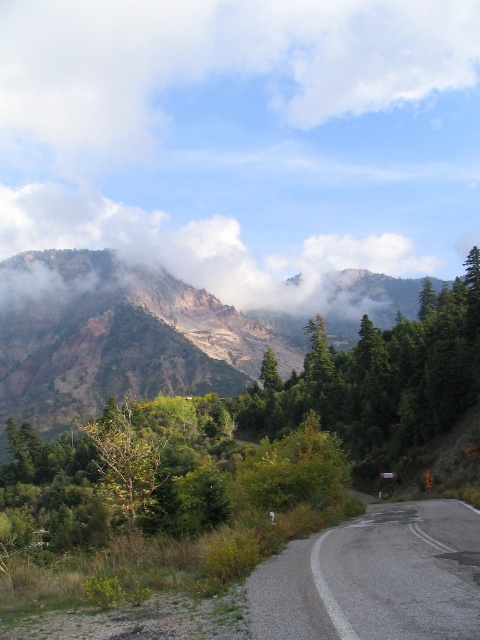
Does foggy misty mountain at upper center appear under green leafy tree at center?

No.

Describe the element at coordinates (216, 253) in the screenshot. I see `foggy misty mountain at upper center` at that location.

Find the location of a particular element. The height and width of the screenshot is (640, 480). foggy misty mountain at upper center is located at coordinates (216, 253).

Is rustic stone mountain at upper left positioned behind green leafy tree at center?

Yes, it is behind green leafy tree at center.

Is rustic stone mountain at upper left smaller than green leafy tree at center?

No.

The width and height of the screenshot is (480, 640). In order to click on rustic stone mountain at upper left in this screenshot , I will do `click(120, 337)`.

Between gray asphalt road at lower right and green leafy tree at center, which one is positioned higher?

gray asphalt road at lower right is above.

Image resolution: width=480 pixels, height=640 pixels. Describe the element at coordinates (374, 579) in the screenshot. I see `gray asphalt road at lower right` at that location.

This screenshot has height=640, width=480. I want to click on gray asphalt road at lower right, so [374, 579].